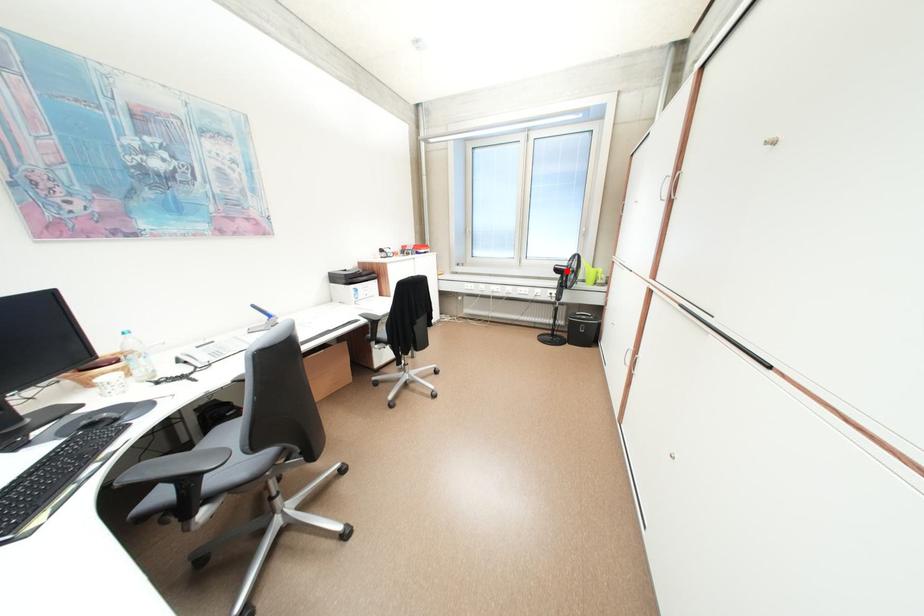
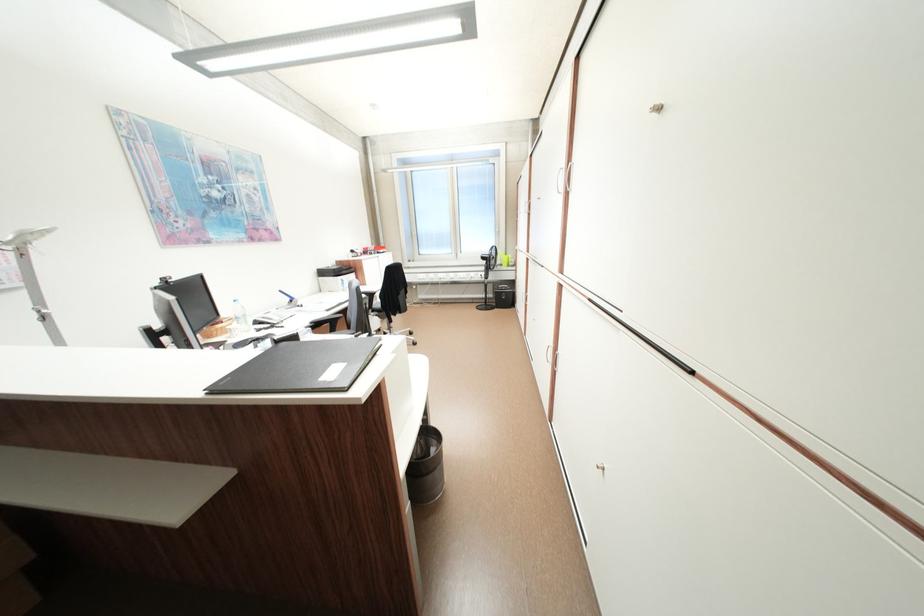
Find the pixel in the second image that matches the highlighted location in the first image.

(492, 259)